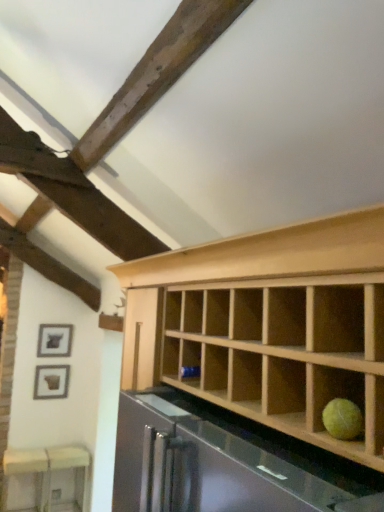
Question: Is matte black picture frame at upper left, the second picture frame from the bottom, to the right of matte black picture frame at lower left, the 2th picture frame when ordered from top to bottom, from the viewer's perspective?

Choices:
 (A) no
 (B) yes

Answer: (B)

Question: Can you see matte black picture frame at upper left, acting as the first picture frame starting from the top, touching matte black picture frame at lower left, which ranks as the 1th picture frame in bottom-to-top order?

Choices:
 (A) no
 (B) yes

Answer: (A)

Question: Considering the relative sizes of matte black picture frame at upper left, acting as the first picture frame starting from the top, and matte black picture frame at lower left, which ranks as the 1th picture frame in bottom-to-top order, in the image provided, is matte black picture frame at upper left, acting as the first picture frame starting from the top, bigger than matte black picture frame at lower left, which ranks as the 1th picture frame in bottom-to-top order,?

Choices:
 (A) no
 (B) yes

Answer: (A)

Question: Is matte black picture frame at upper left, acting as the first picture frame starting from the top, at the left side of matte black picture frame at lower left, the 2th picture frame when ordered from top to bottom?

Choices:
 (A) no
 (B) yes

Answer: (A)

Question: Is matte black picture frame at upper left, acting as the first picture frame starting from the top, taller than matte black picture frame at lower left, which ranks as the 1th picture frame in bottom-to-top order?

Choices:
 (A) no
 (B) yes

Answer: (A)

Question: From a real-world perspective, is matte black picture frame at upper left, acting as the first picture frame starting from the top, positioned under matte black picture frame at lower left, the 2th picture frame when ordered from top to bottom, based on gravity?

Choices:
 (A) no
 (B) yes

Answer: (A)

Question: Is the depth of matte black picture frame at lower left, the 2th picture frame when ordered from top to bottom, less than that of white glossy table at lower left?

Choices:
 (A) no
 (B) yes

Answer: (A)

Question: Is matte black picture frame at lower left, the 2th picture frame when ordered from top to bottom, positioned behind white glossy table at lower left?

Choices:
 (A) yes
 (B) no

Answer: (A)

Question: Is matte black picture frame at lower left, the 2th picture frame when ordered from top to bottom, to the left of white glossy table at lower left from the viewer's perspective?

Choices:
 (A) yes
 (B) no

Answer: (B)

Question: Is matte black picture frame at lower left, the 2th picture frame when ordered from top to bottom, positioned far away from white glossy table at lower left?

Choices:
 (A) no
 (B) yes

Answer: (A)

Question: Can you see matte black picture frame at lower left, which ranks as the 1th picture frame in bottom-to-top order, touching white glossy table at lower left?

Choices:
 (A) no
 (B) yes

Answer: (A)

Question: Does matte black picture frame at lower left, which ranks as the 1th picture frame in bottom-to-top order, have a greater width compared to white glossy table at lower left?

Choices:
 (A) yes
 (B) no

Answer: (B)

Question: From a real-world perspective, is white glossy table at lower left physically below matte black picture frame at lower left, which ranks as the 1th picture frame in bottom-to-top order?

Choices:
 (A) no
 (B) yes

Answer: (B)